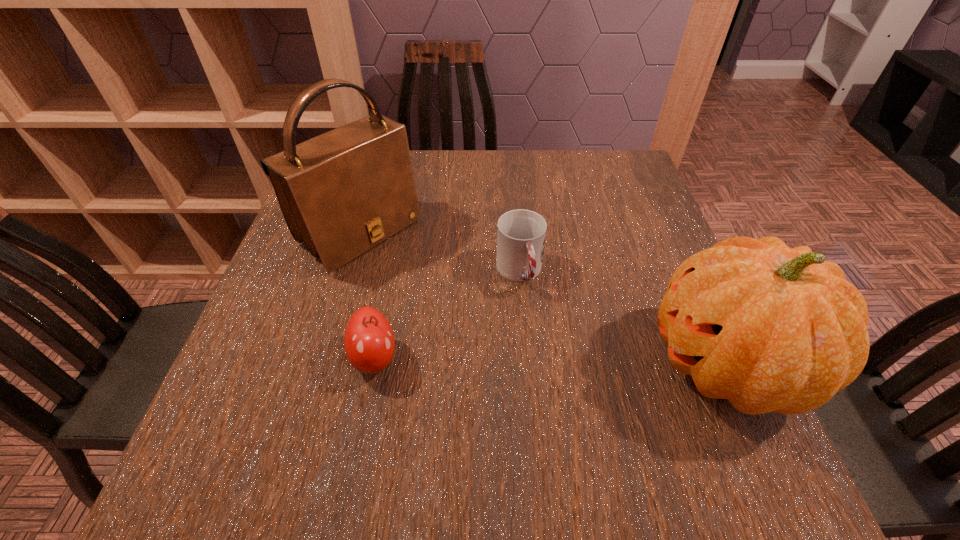
The image size is (960, 540). Find the location of `vacant spot on the desktop that is between the apple and the third shortest object and is positioned on the handle side of the cup`. vacant spot on the desktop that is between the apple and the third shortest object and is positioned on the handle side of the cup is located at coordinates [x=553, y=361].

Identify the location of vacant space on the desktop that is between the apple and the rightmost object and is positioned on the front flap of the shoulder bag. Image resolution: width=960 pixels, height=540 pixels. (533, 361).